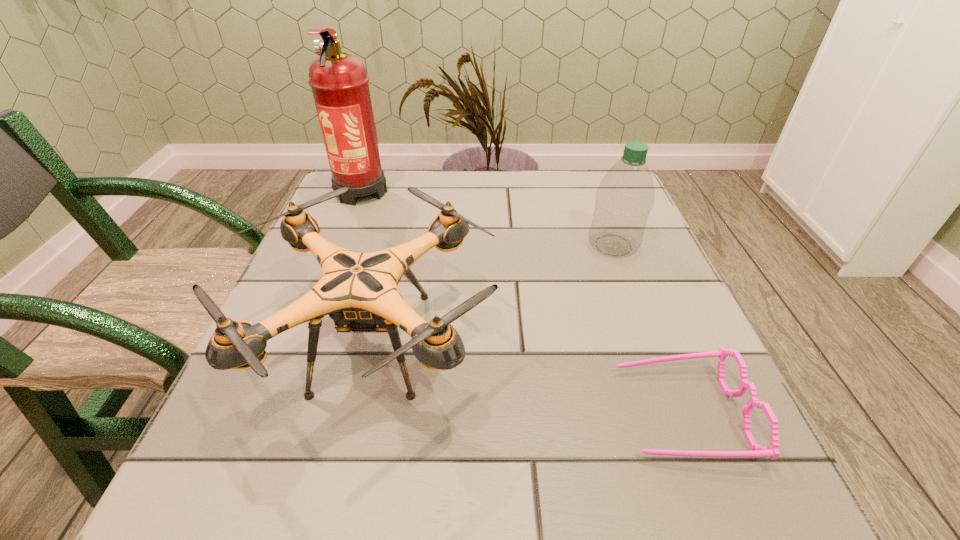
At what (x,y) coordinates should I click in order to perform the action: click on unoccupied position between the second farthest object and the spectacles. Please return your answer as a coordinate pair (x, y). Looking at the image, I should click on (647, 329).

Locate an element on the screen. This screenshot has width=960, height=540. free area in between the tallest object and the spectacles is located at coordinates (521, 301).

I want to click on free space between the spectacles and the second farthest object, so click(647, 329).

The width and height of the screenshot is (960, 540). I want to click on free point between the spectacles and the water bottle, so click(x=647, y=329).

Where is `empty space between the spectacles and the drone`? The height and width of the screenshot is (540, 960). empty space between the spectacles and the drone is located at coordinates (527, 377).

Image resolution: width=960 pixels, height=540 pixels. Find the location of `unoccupied position between the third nearest object and the farthest object`. unoccupied position between the third nearest object and the farthest object is located at coordinates (488, 218).

In order to click on the second closest object relative to the tallest object in this screenshot , I will do `click(625, 196)`.

Locate an element on the screen. This screenshot has width=960, height=540. object that stands as the closest to the tallest object is located at coordinates tap(358, 290).

The height and width of the screenshot is (540, 960). In order to click on vacant space that satisfies the following two spatial constraints: 1. on the front-facing side of the fire extinguisher; 2. on the right side of the second farthest object in this screenshot , I will do `click(340, 245)`.

The width and height of the screenshot is (960, 540). I want to click on free space that satisfies the following two spatial constraints: 1. on the front-facing side of the tallest object; 2. on the left side of the water bottle, so click(x=340, y=245).